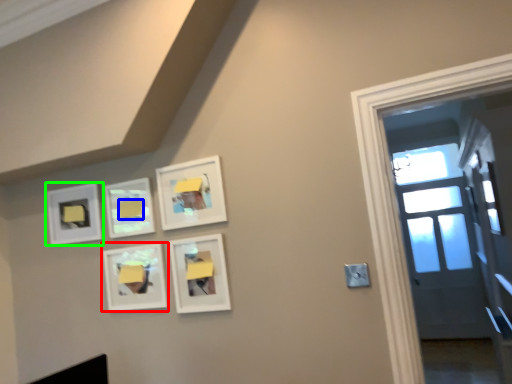
Question: Based on their relative distances, which object is nearer to picture frame (highlighted by a red box)? Choose from lift (highlighted by a blue box) and picture frame (highlighted by a green box).

Choices:
 (A) lift
 (B) picture frame

Answer: (A)